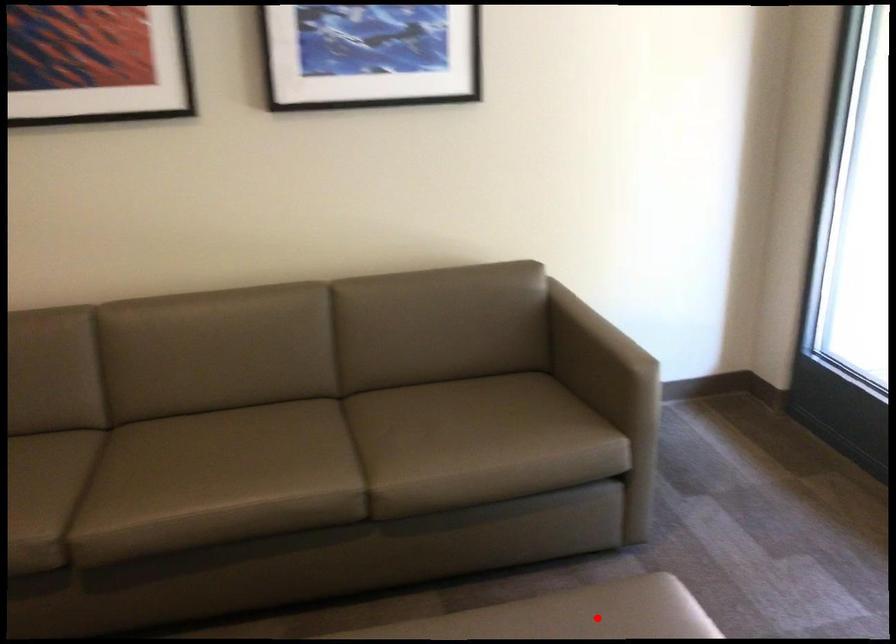
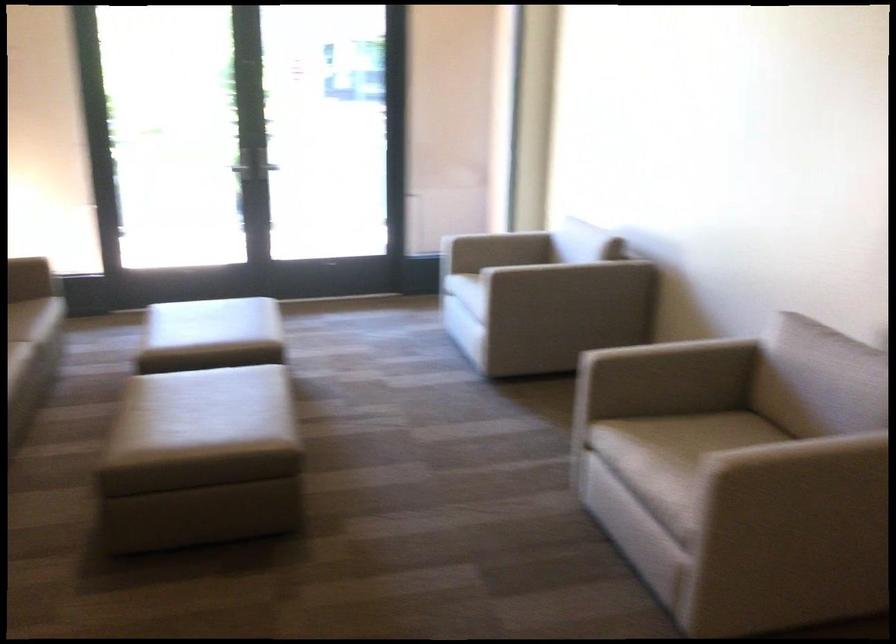
In the second image, find the point that corresponds to the highlighted location in the first image.

(150, 305)